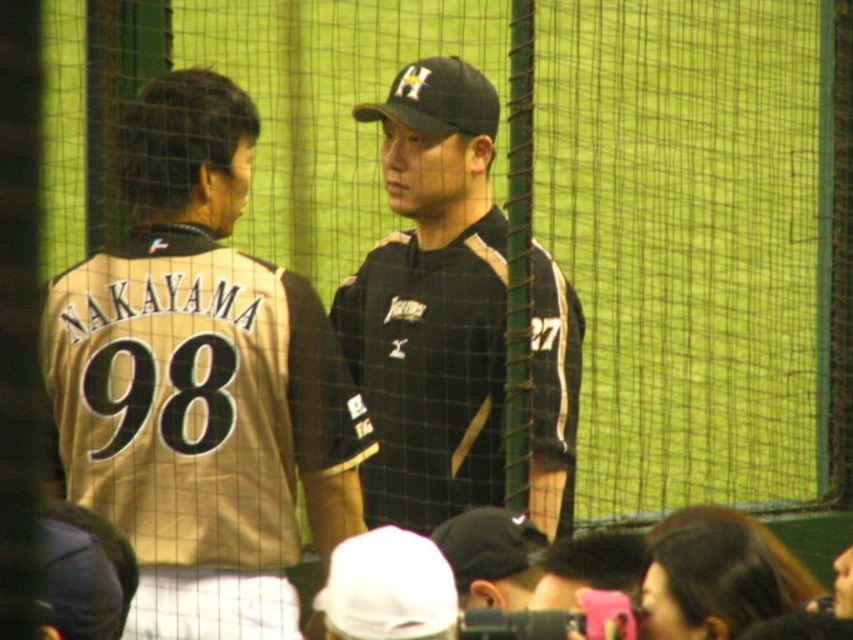
You are a photographer positioned behind the two individuals in the baseball scene. You want to take a photo where both the gold jersey at left and the black matte uniform at center are clearly visible. Considering their positions, which one should you focus on first to ensure both are in sharp focus?

The gold jersey at left is closer to the viewer than the black matte uniform at center. To ensure both are in sharp focus, you should focus on the gold jersey at left first, as focusing on the closer object helps maintain clarity for the farther one as well.

You are a photographer at a baseball field and need to capture a photo of the gold jersey at left and the black matte uniform at center. Based on their positions, which one is located to the right of the other?

The gold jersey at left is positioned on the left side of black matte uniform at center, so the black matte uniform at center is to the right of the gold jersey at left.